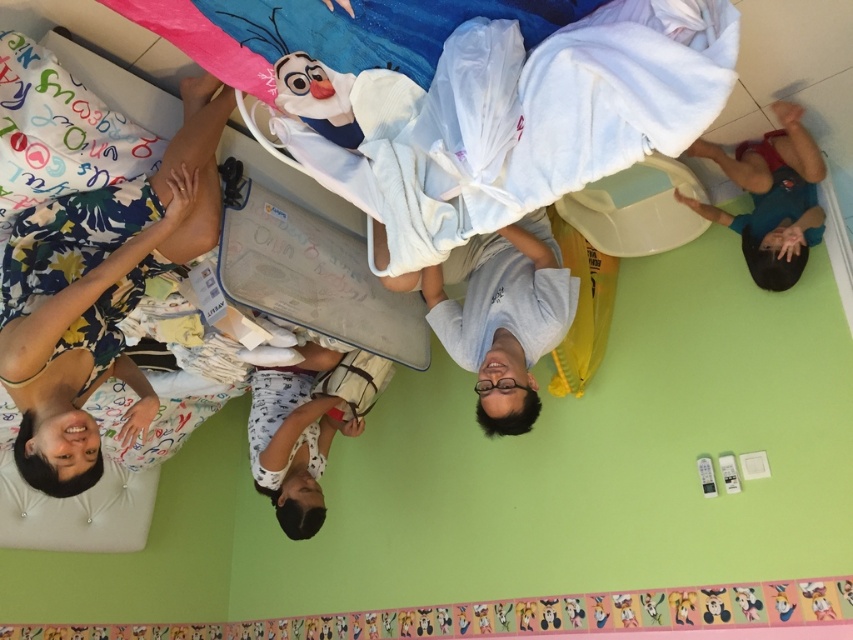
You are standing in the playroom and want to reach both the point at coordinates (x=67, y=369) and the point at coordinates (x=282, y=384). Which point should you head toward first to reach the closer one?

The point at coordinates (x=67, y=369) is closer to you than the point at coordinates (x=282, y=384), so you should head toward the point at coordinates (x=67, y=369) first.

You are a guest in this room and want to know which object is taller between the white fabric bed at upper left and the floral fabric dress at lower left. Can you tell me which one is taller?

The white fabric bed at upper left is not as tall as the floral fabric dress at lower left, so the floral fabric dress at lower left is taller.